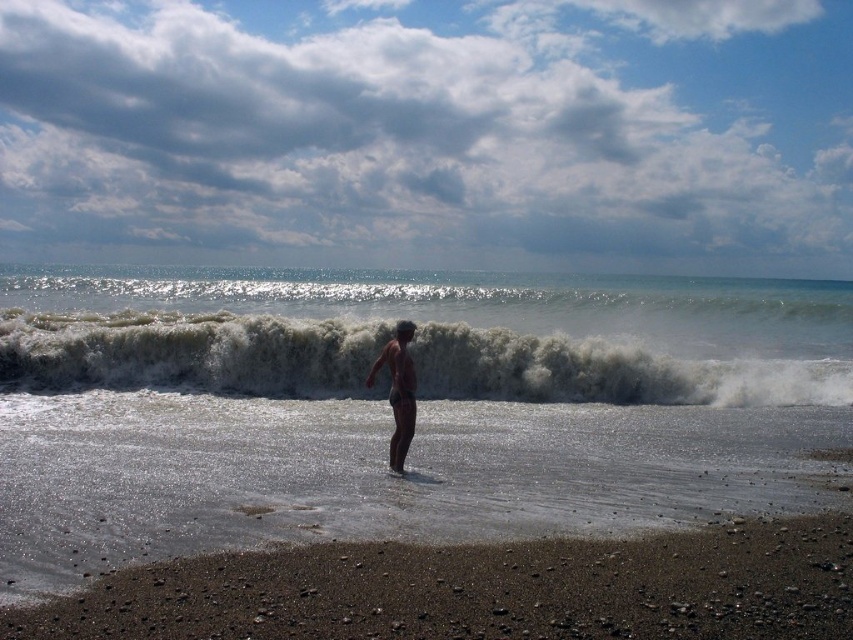
Question: Is dark brown pebbles at lower center thinner than brown matte skin at center?

Choices:
 (A) no
 (B) yes

Answer: (A)

Question: Does dark brown pebbles at lower center have a lesser width compared to brown matte skin at center?

Choices:
 (A) no
 (B) yes

Answer: (A)

Question: Can you confirm if white frothy wave at center is smaller than brown matte skin at center?

Choices:
 (A) no
 (B) yes

Answer: (A)

Question: Which of the following is the farthest from the observer?

Choices:
 (A) (727, 349)
 (B) (751, 627)

Answer: (A)

Question: Among these points, which one is nearest to the camera?

Choices:
 (A) (408, 365)
 (B) (38, 381)

Answer: (A)

Question: Among these points, which one is farthest from the camera?

Choices:
 (A) (160, 330)
 (B) (576, 550)
 (C) (374, 364)

Answer: (A)